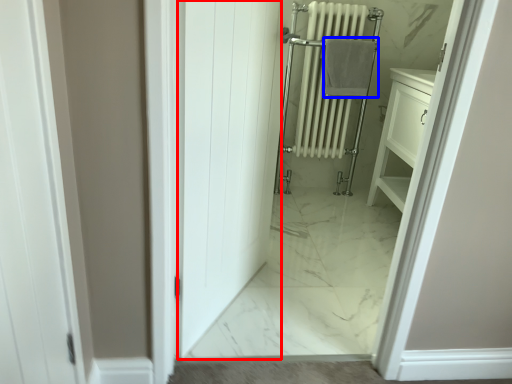
Question: Which object is closer to the camera taking this photo, door (highlighted by a red box) or bath towel (highlighted by a blue box)?

Choices:
 (A) door
 (B) bath towel

Answer: (A)